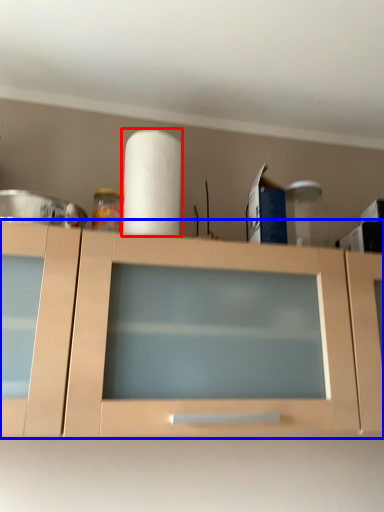
Question: Among these objects, which one is farthest to the camera, paper towel (highlighted by a red box) or cabinetry (highlighted by a blue box)?

Choices:
 (A) paper towel
 (B) cabinetry

Answer: (A)